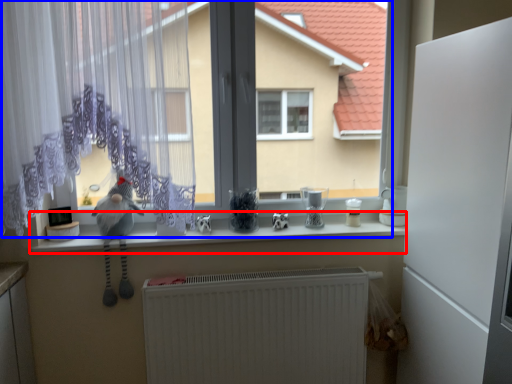
Question: Which object appears closest to the camera in this image, counter top (highlighted by a red box) or bay window (highlighted by a blue box)?

Choices:
 (A) counter top
 (B) bay window

Answer: (B)